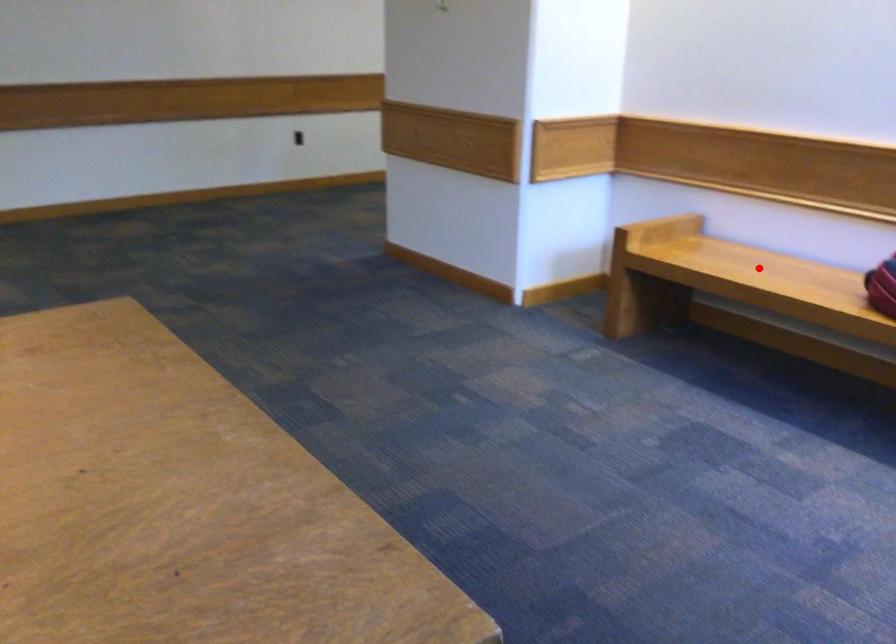
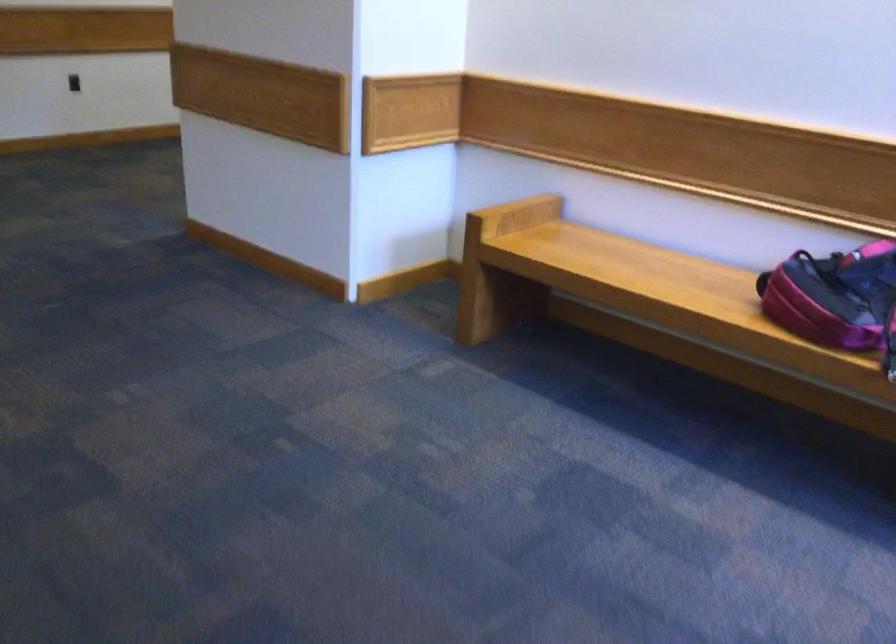
The point at the highlighted location is marked in the first image. Where is the corresponding point in the second image?

(633, 270)